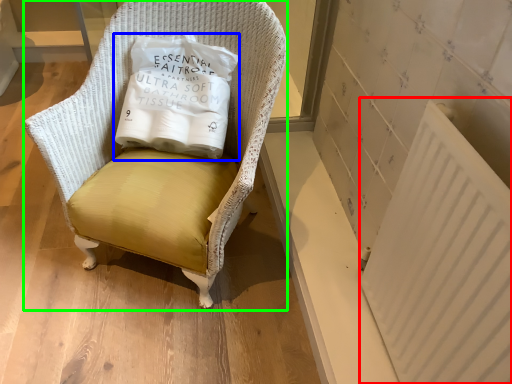
Question: Based on their relative distances, which object is farther from radiator (highlighted by a red box)? Choose from pillow (highlighted by a blue box) and chair (highlighted by a green box).

Choices:
 (A) pillow
 (B) chair

Answer: (A)